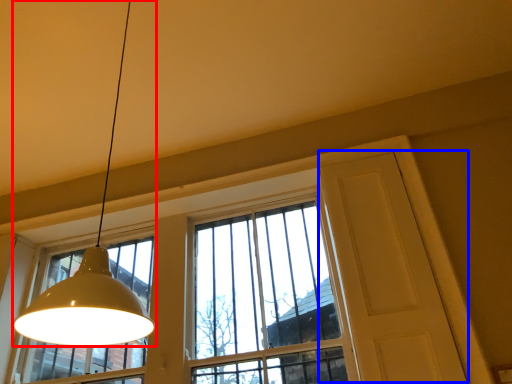
Question: Which point is closer to the camera, lamp (highlighted by a red box) or screen door (highlighted by a blue box)?

Choices:
 (A) lamp
 (B) screen door

Answer: (A)